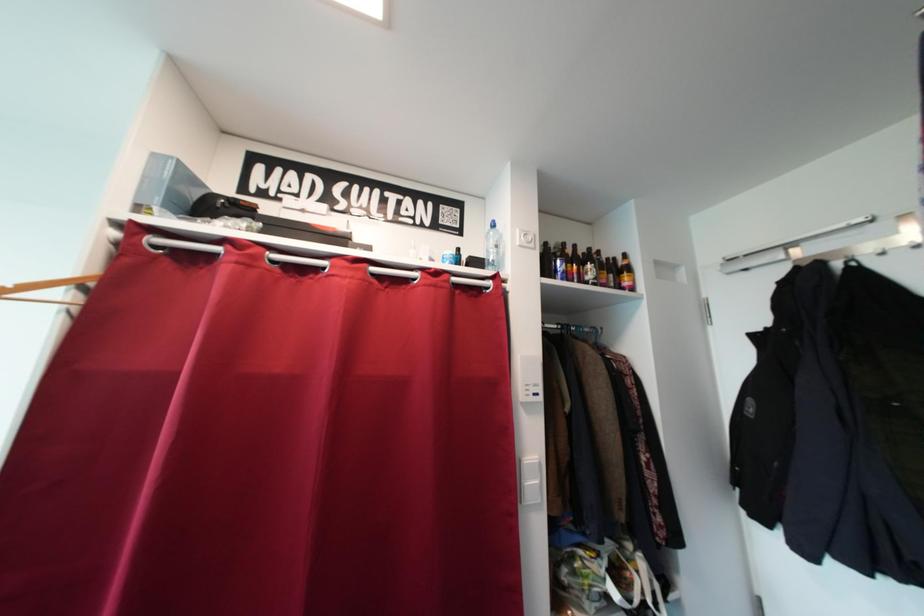
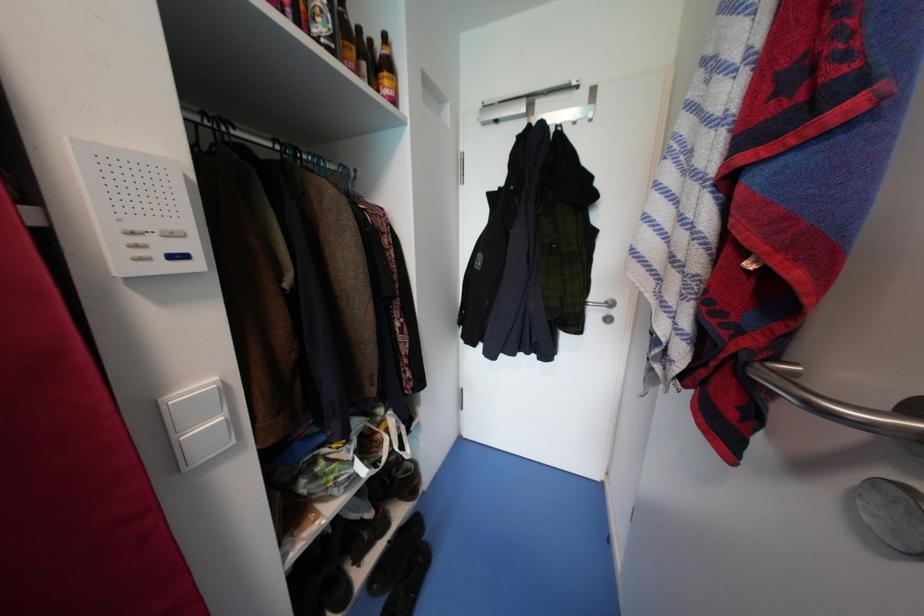
Based on the continuous images, in which direction is the camera rotating?

The rotation direction of the camera is right-down.